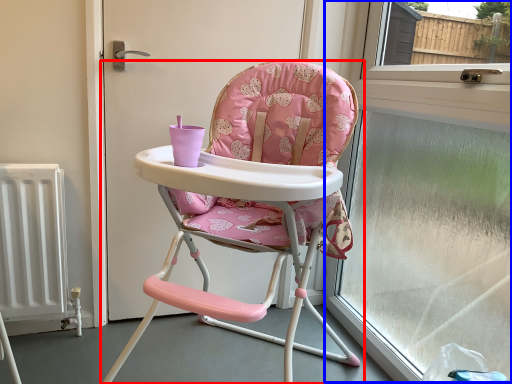
Question: Among these objects, which one is farthest to the camera, chair (highlighted by a red box) or window frame (highlighted by a blue box)?

Choices:
 (A) chair
 (B) window frame

Answer: (B)